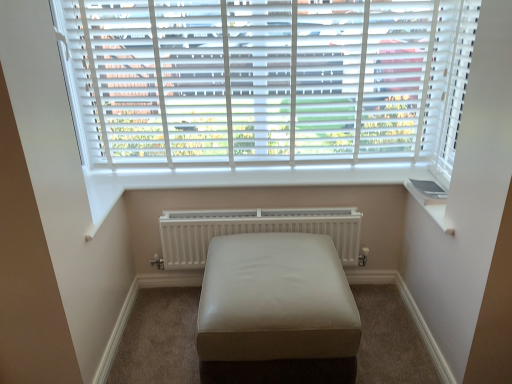
Question: Is beige leather ottoman at center positioned behind white matte blinds at upper center?

Choices:
 (A) no
 (B) yes

Answer: (A)

Question: Are beige leather ottoman at center and white matte blinds at upper center located far from each other?

Choices:
 (A) yes
 (B) no

Answer: (B)

Question: Could you tell me if beige leather ottoman at center is facing white matte blinds at upper center?

Choices:
 (A) yes
 (B) no

Answer: (B)

Question: Considering the relative sizes of beige leather ottoman at center and white matte blinds at upper center in the image provided, is beige leather ottoman at center shorter than white matte blinds at upper center?

Choices:
 (A) no
 (B) yes

Answer: (B)

Question: Is beige leather ottoman at center positioned with its back to white matte blinds at upper center?

Choices:
 (A) no
 (B) yes

Answer: (A)

Question: From a real-world perspective, is beige leather ottoman at center above or below white matte radiator at center?

Choices:
 (A) below
 (B) above

Answer: (A)

Question: Considering the relative positions of beige leather ottoman at center and white matte radiator at center in the image provided, is beige leather ottoman at center to the left or to the right of white matte radiator at center?

Choices:
 (A) left
 (B) right

Answer: (B)

Question: Considering their positions, is beige leather ottoman at center located in front of or behind white matte radiator at center?

Choices:
 (A) behind
 (B) front

Answer: (B)

Question: Based on their sizes in the image, would you say beige leather ottoman at center is bigger or smaller than white matte radiator at center?

Choices:
 (A) big
 (B) small

Answer: (A)

Question: Does point (289, 213) appear closer or farther from the camera than point (372, 36)?

Choices:
 (A) farther
 (B) closer

Answer: (A)

Question: Is white matte radiator at center inside the boundaries of white matte blinds at upper center, or outside?

Choices:
 (A) outside
 (B) inside

Answer: (A)

Question: Considering the positions of white matte radiator at center and white matte blinds at upper center in the image, is white matte radiator at center taller or shorter than white matte blinds at upper center?

Choices:
 (A) short
 (B) tall

Answer: (A)

Question: From the image's perspective, is white matte radiator at center positioned above or below white matte blinds at upper center?

Choices:
 (A) below
 (B) above

Answer: (A)

Question: Does point (310, 94) appear closer or farther from the camera than point (332, 316)?

Choices:
 (A) closer
 (B) farther

Answer: (B)

Question: Considering their positions, is white matte blinds at upper center located in front of or behind beige leather ottoman at center?

Choices:
 (A) front
 (B) behind

Answer: (B)